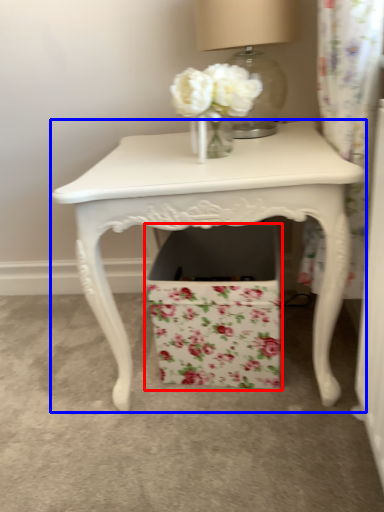
Question: Which point is further to the camera, cardboard box (highlighted by a red box) or table (highlighted by a blue box)?

Choices:
 (A) cardboard box
 (B) table

Answer: (A)